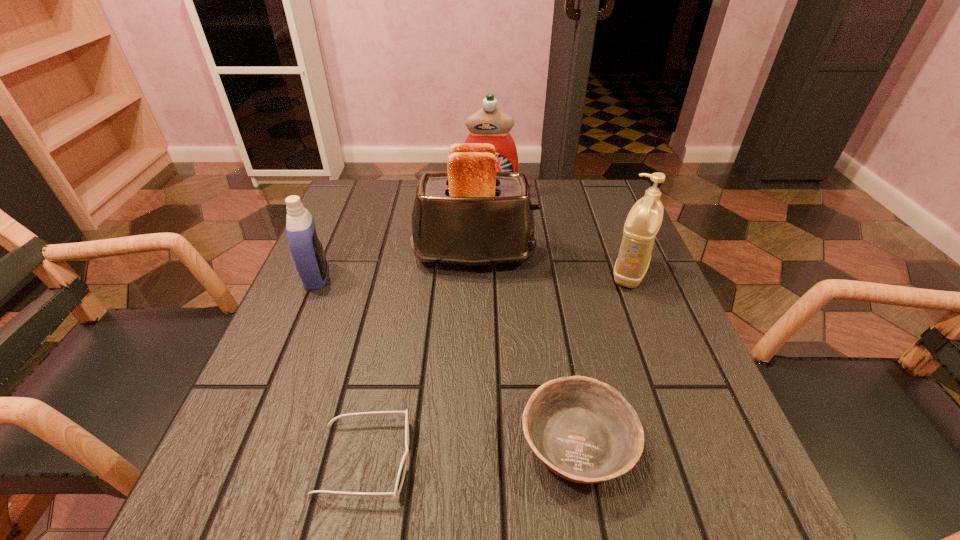
Where is `the farthest detergent`? The image size is (960, 540). the farthest detergent is located at coordinates (491, 125).

The height and width of the screenshot is (540, 960). Identify the location of the farthest object. (491, 125).

Locate an element on the screen. toaster is located at coordinates (472, 215).

Find the location of `the rightmost detergent`. the rightmost detergent is located at coordinates (644, 220).

At what (x,y) coordinates should I click in order to perform the action: click on the leftmost object. Please return your answer as a coordinate pair (x, y). This screenshot has height=540, width=960. Looking at the image, I should click on (306, 248).

Find the location of `bowl`. bowl is located at coordinates (583, 430).

The height and width of the screenshot is (540, 960). Identify the location of sunglasses. (402, 469).

This screenshot has width=960, height=540. I want to click on vacant space located 0.180m on the front surface of the second detergent from right to left, so click(x=490, y=239).

Image resolution: width=960 pixels, height=540 pixels. What are the coordinates of `vacant space situated 0.210m on the side of the toaster with the control lever` in the screenshot? It's located at (626, 255).

Identify the location of free space located on the front of the rightmost detergent. [691, 431].